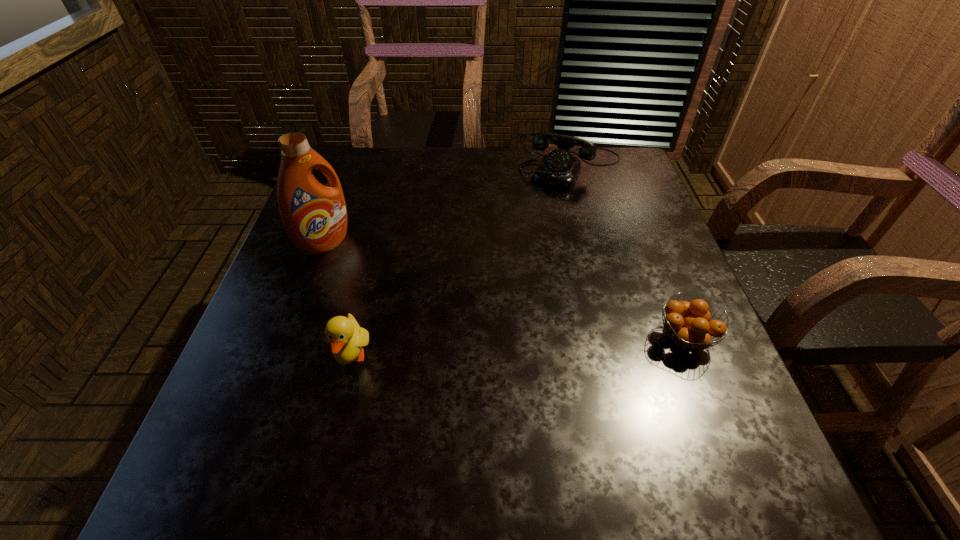
In the image, there is a desktop. Identify the location of free space at the left edge. (336, 295).

This screenshot has height=540, width=960. In order to click on vacant space at the right edge of the desktop in this screenshot , I will do `click(650, 228)`.

Where is `vacant space at the far left corner of the desktop`? The width and height of the screenshot is (960, 540). vacant space at the far left corner of the desktop is located at coordinates (370, 158).

Locate an element on the screen. This screenshot has height=540, width=960. free region at the far right corner is located at coordinates (605, 191).

This screenshot has height=540, width=960. What are the coordinates of `vacant space at the near right corner` in the screenshot? It's located at (677, 418).

At what (x,y) coordinates should I click in order to perform the action: click on unoccupied area between the farthest object and the tallest object. Please return your answer as a coordinate pair (x, y). Looking at the image, I should click on (448, 205).

At what (x,y) coordinates should I click in order to perform the action: click on free point between the shortest object and the tallest object. Please return your answer as a coordinate pair (x, y). Looking at the image, I should click on (505, 291).

I want to click on free space between the telephone and the detergent, so click(x=448, y=205).

The height and width of the screenshot is (540, 960). I want to click on vacant point located between the farthest object and the duckling, so click(x=462, y=262).

Image resolution: width=960 pixels, height=540 pixels. What are the coordinates of `free space between the orange fruit and the second object from left to right` in the screenshot? It's located at (518, 348).